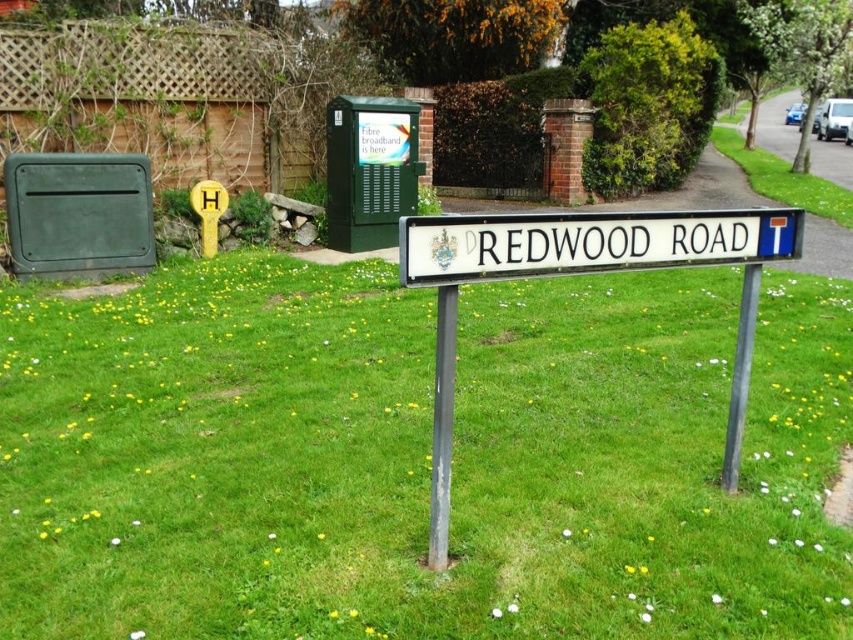
You are a delivery driver approaching Redwood Road and need to park your vehicle. The parking rules are displayed on the white plastic street sign at center attached to the metallic pole at center. Can you determine if the sign is mounted on the pole or placed next to it?

The white plastic street sign at center is positioned over metallic pole at center, so the sign is mounted on the pole.

Based on the photo, you are standing in front of the white plastic street sign at center and the metallic pole at center. Which object is nearer to you?

The white plastic street sign at center is closer to the viewer than the metallic pole at center, so it is nearer.

You are standing at the origin point of a coordinate system where the image is mapped. The white plastic street sign at center is located at coordinates approximately 0.427 in the x direction and 0.682 in the y direction. If you want to move directly towards the sign, which direction should you move in terms of x and y coordinates?

To move directly towards the white plastic street sign at center located at coordinates x 0.427 and y 0.682, you should move in the positive x and positive y direction since the sign is at higher x and y values than the origin.